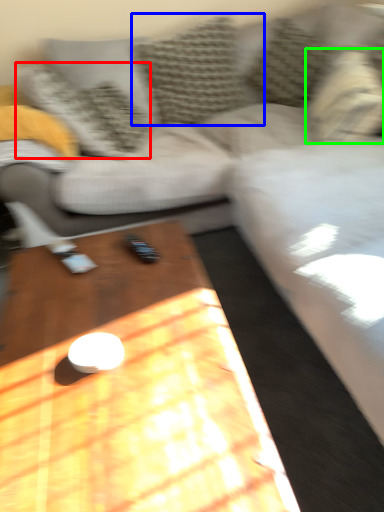
Question: Which object is the closest to the pillow (highlighted by a red box)? Choose among these: pillow (highlighted by a blue box) or pillow (highlighted by a green box).

Choices:
 (A) pillow
 (B) pillow

Answer: (A)